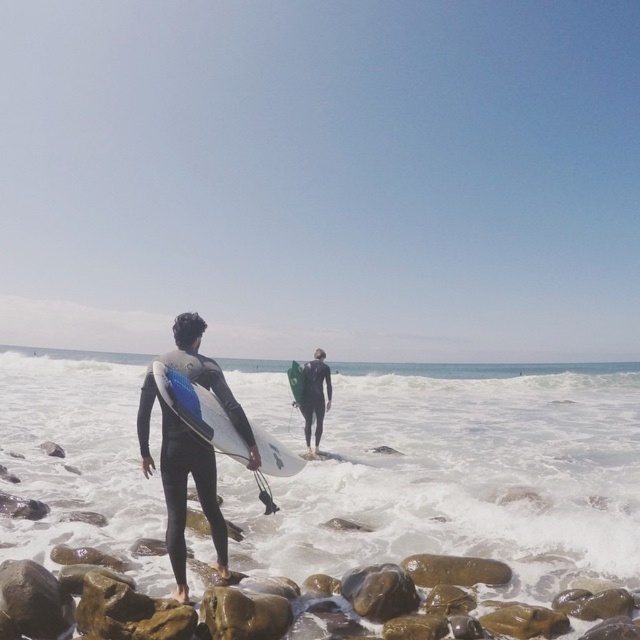
Is white foam water at lower center below black matte wetsuit at center?

Yes, white foam water at lower center is below black matte wetsuit at center.

Does white foam water at lower center have a smaller size compared to black matte wetsuit at center?

No.

Where is `white foam water at lower center`? This screenshot has width=640, height=640. white foam water at lower center is located at coordinates (461, 476).

The width and height of the screenshot is (640, 640). What are the coordinates of `white foam water at lower center` in the screenshot? It's located at (461, 476).

Who is higher up, white foam water at lower center or black wetsuit at center?

black wetsuit at center is above.

Can you confirm if white foam water at lower center is positioned below black wetsuit at center?

Yes, white foam water at lower center is below black wetsuit at center.

This screenshot has height=640, width=640. In order to click on white foam water at lower center in this screenshot , I will do `click(461, 476)`.

Is white foam water at lower center positioned before green matte surfboard at center?

Yes, white foam water at lower center is in front of green matte surfboard at center.

Can you confirm if white foam water at lower center is wider than green matte surfboard at center?

Yes.

Between point (420, 428) and point (292, 381), which one is positioned in front?

Point (292, 381) is more forward.

Identify the location of white foam water at lower center. The height and width of the screenshot is (640, 640). [461, 476].